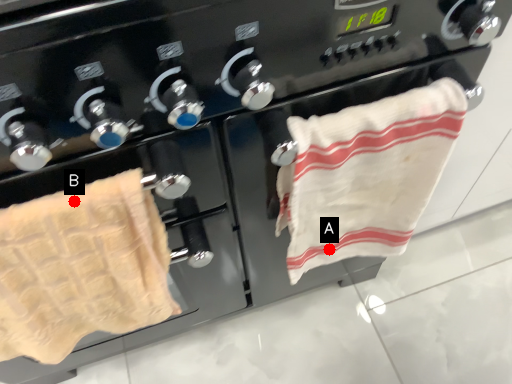
Question: Two points are circled on the image, labeled by A and B beside each circle. Which point is closer to the camera?

Choices:
 (A) A is closer
 (B) B is closer

Answer: (B)